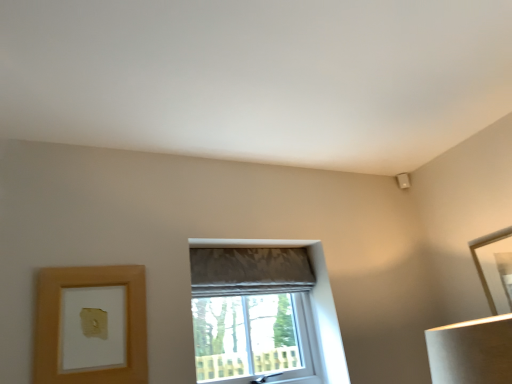
Where is `matte gray curtain at center`? The height and width of the screenshot is (384, 512). matte gray curtain at center is located at coordinates (249, 271).

Describe the element at coordinates (64, 320) in the screenshot. I see `wooden picture frame at lower left, the second picture frame when ordered from back to front` at that location.

What is the approximate height of wooden picture frame at lower left, which is the first picture frame in front-to-back order?

The height of wooden picture frame at lower left, which is the first picture frame in front-to-back order, is 18.75 inches.

Where is `matte gray curtain at center`? This screenshot has height=384, width=512. matte gray curtain at center is located at coordinates (249, 271).

Is matte gray curtain at center at the right side of matte gray fabric window at center?

No.

Which of these two, matte gray curtain at center or matte gray fabric window at center, is thinner?

matte gray curtain at center.

Which of these two, matte gray curtain at center or matte gray fabric window at center, stands taller?

Standing taller between the two is matte gray fabric window at center.

Which is more to the right, gold metallic picture frame at upper right, which is the 2th picture frame from front to back, or matte gray curtain at center?

From the viewer's perspective, gold metallic picture frame at upper right, which is the 2th picture frame from front to back, appears more on the right side.

Would you say gold metallic picture frame at upper right, placed as the 1th picture frame when sorted from back to front, is inside or outside matte gray curtain at center?

gold metallic picture frame at upper right, placed as the 1th picture frame when sorted from back to front, is located beyond the bounds of matte gray curtain at center.

Who is shorter, gold metallic picture frame at upper right, the second picture frame viewed from the left, or matte gray curtain at center?

matte gray curtain at center is shorter.

Considering the points (481, 242) and (336, 368), which point is behind, point (481, 242) or point (336, 368)?

The point (481, 242) is farther from the camera.

Can you tell me how much gold metallic picture frame at upper right, which is the 2th picture frame from front to back, and matte gray fabric window at center differ in facing direction?

They differ by 90.1 degrees in their facing directions.

Is gold metallic picture frame at upper right, which is the 2th picture frame from front to back, facing towards matte gray fabric window at center?

No, gold metallic picture frame at upper right, which is the 2th picture frame from front to back, is not oriented towards matte gray fabric window at center.

Is gold metallic picture frame at upper right, the second picture frame viewed from the left, positioned beyond the bounds of matte gray fabric window at center?

Yes, gold metallic picture frame at upper right, the second picture frame viewed from the left, is outside of matte gray fabric window at center.

In the image, is matte gray fabric window at center on the left side or the right side of gold metallic picture frame at upper right, acting as the first picture frame starting from the right?

Clearly, matte gray fabric window at center is on the left of gold metallic picture frame at upper right, acting as the first picture frame starting from the right, in the image.

From the image's perspective, between matte gray fabric window at center and gold metallic picture frame at upper right, placed as the 1th picture frame when sorted from back to front, which one is located above?

gold metallic picture frame at upper right, placed as the 1th picture frame when sorted from back to front, appears higher in the image.

How many degrees apart are the facing directions of matte gray fabric window at center and gold metallic picture frame at upper right, placed as the 1th picture frame when sorted from back to front?

The angle between the facing direction of matte gray fabric window at center and the facing direction of gold metallic picture frame at upper right, placed as the 1th picture frame when sorted from back to front, is 90.1 degrees.

Is matte gray fabric window at center positioned with its back to gold metallic picture frame at upper right, placed as the 1th picture frame when sorted from back to front?

No.

Is matte gray curtain at center far away from gold metallic picture frame at upper right, which is the 2th picture frame from front to back?

matte gray curtain at center is far away from gold metallic picture frame at upper right, which is the 2th picture frame from front to back.

How many degrees apart are the facing directions of matte gray curtain at center and gold metallic picture frame at upper right, placed as the 1th picture frame when sorted from back to front?

The angular difference between matte gray curtain at center and gold metallic picture frame at upper right, placed as the 1th picture frame when sorted from back to front, is 90.1 degrees.

Who is taller, matte gray curtain at center or gold metallic picture frame at upper right, placed as the 1th picture frame when sorted from back to front?

With more height is gold metallic picture frame at upper right, placed as the 1th picture frame when sorted from back to front.

Locate an element on the screen. Image resolution: width=512 pixels, height=384 pixels. curtain below the gold metallic picture frame at upper right, the second picture frame viewed from the left (from the image's perspective) is located at coordinates (249, 271).

From the image's perspective, relative to matte gray curtain at center, is wooden picture frame at lower left, positioned as the 1th picture frame in left-to-right order, above or below?

Based on their image positions, wooden picture frame at lower left, positioned as the 1th picture frame in left-to-right order, is located beneath matte gray curtain at center.

Consider the image. Considering the sizes of objects wooden picture frame at lower left, the second picture frame when ordered from back to front, and matte gray curtain at center in the image provided, who is thinner, wooden picture frame at lower left, the second picture frame when ordered from back to front, or matte gray curtain at center?

Thinner between the two is wooden picture frame at lower left, the second picture frame when ordered from back to front.

Is wooden picture frame at lower left, which is the first picture frame in front-to-back order, at the right side of matte gray curtain at center?

Incorrect, wooden picture frame at lower left, which is the first picture frame in front-to-back order, is not on the right side of matte gray curtain at center.

Could you tell me if wooden picture frame at lower left, the second picture frame when ordered from back to front, is turned towards matte gray curtain at center?

No, wooden picture frame at lower left, the second picture frame when ordered from back to front, is not aimed at matte gray curtain at center.

Can you confirm if matte gray fabric window at center is smaller than wooden picture frame at lower left, which is the first picture frame in front-to-back order?

No.

Could wooden picture frame at lower left, the second picture frame when ordered from back to front, be considered to be inside matte gray fabric window at center?

No.

Is matte gray fabric window at center to the left of wooden picture frame at lower left, the second picture frame positioned from the right, from the viewer's perspective?

Incorrect, matte gray fabric window at center is not on the left side of wooden picture frame at lower left, the second picture frame positioned from the right.

How different are the orientations of matte gray fabric window at center and wooden picture frame at lower left, the second picture frame when ordered from back to front, in degrees?

matte gray fabric window at center and wooden picture frame at lower left, the second picture frame when ordered from back to front, are facing 0.00156 degrees away from each other.

Image resolution: width=512 pixels, height=384 pixels. I want to click on curtain behind the matte gray fabric window at center, so click(x=249, y=271).

Find the location of `picture frame above the matte gray curtain at center (from the image's perspective)`. picture frame above the matte gray curtain at center (from the image's perspective) is located at coordinates (495, 268).

Estimate the real-world distances between objects in this image. Which object is closer to wooden picture frame at lower left, positioned as the 1th picture frame in left-to-right order, matte gray fabric window at center or gold metallic picture frame at upper right, acting as the first picture frame starting from the right?

matte gray fabric window at center.

Looking at this image, estimate the real-world distances between objects in this image. Which object is closer to wooden picture frame at lower left, which is the first picture frame in front-to-back order, matte gray curtain at center or gold metallic picture frame at upper right, acting as the first picture frame starting from the right?

Among the two, matte gray curtain at center is located nearer to wooden picture frame at lower left, which is the first picture frame in front-to-back order.

Considering their positions, is matte gray fabric window at center positioned further to matte gray curtain at center than gold metallic picture frame at upper right, the second picture frame viewed from the left?

gold metallic picture frame at upper right, the second picture frame viewed from the left, lies further to matte gray curtain at center than the other object.

Considering their positions, is matte gray curtain at center positioned further to matte gray fabric window at center than wooden picture frame at lower left, which is the first picture frame in front-to-back order?

wooden picture frame at lower left, which is the first picture frame in front-to-back order, lies further to matte gray fabric window at center than the other object.

Based on the photo, looking at the image, which one is located further to gold metallic picture frame at upper right, acting as the first picture frame starting from the right, wooden picture frame at lower left, which is the first picture frame in front-to-back order, or matte gray curtain at center?

Based on the image, wooden picture frame at lower left, which is the first picture frame in front-to-back order, appears to be further to gold metallic picture frame at upper right, acting as the first picture frame starting from the right.

Looking at the image, which one is located closer to matte gray curtain at center, wooden picture frame at lower left, the second picture frame positioned from the right, or gold metallic picture frame at upper right, the second picture frame viewed from the left?

Among the two, wooden picture frame at lower left, the second picture frame positioned from the right, is located nearer to matte gray curtain at center.

Consider the image. Estimate the real-world distances between objects in this image. Which object is closer to wooden picture frame at lower left, which is the first picture frame in front-to-back order, matte gray curtain at center or matte gray fabric window at center?

matte gray curtain at center lies closer to wooden picture frame at lower left, which is the first picture frame in front-to-back order, than the other object.

From the image, which object appears to be farther from matte gray fabric window at center, wooden picture frame at lower left, the second picture frame positioned from the right, or gold metallic picture frame at upper right, placed as the 1th picture frame when sorted from back to front?

gold metallic picture frame at upper right, placed as the 1th picture frame when sorted from back to front, lies further to matte gray fabric window at center than the other object.

At what (x,y) coordinates should I click in order to perform the action: click on window between matte gray curtain at center and gold metallic picture frame at upper right, acting as the first picture frame starting from the right. Please return your answer as a coordinate pair (x, y). This screenshot has width=512, height=384. Looking at the image, I should click on (310, 299).

The width and height of the screenshot is (512, 384). Find the location of `window situated between wooden picture frame at lower left, positioned as the 1th picture frame in left-to-right order, and gold metallic picture frame at upper right, acting as the first picture frame starting from the right, from left to right`. window situated between wooden picture frame at lower left, positioned as the 1th picture frame in left-to-right order, and gold metallic picture frame at upper right, acting as the first picture frame starting from the right, from left to right is located at coordinates pos(310,299).

Locate an element on the screen. The image size is (512, 384). curtain located between wooden picture frame at lower left, which is the first picture frame in front-to-back order, and gold metallic picture frame at upper right, placed as the 1th picture frame when sorted from back to front, in the left-right direction is located at coordinates (249, 271).

At what (x,y) coordinates should I click in order to perform the action: click on curtain situated between wooden picture frame at lower left, the second picture frame when ordered from back to front, and matte gray fabric window at center from left to right. Please return your answer as a coordinate pair (x, y). Looking at the image, I should click on (249, 271).